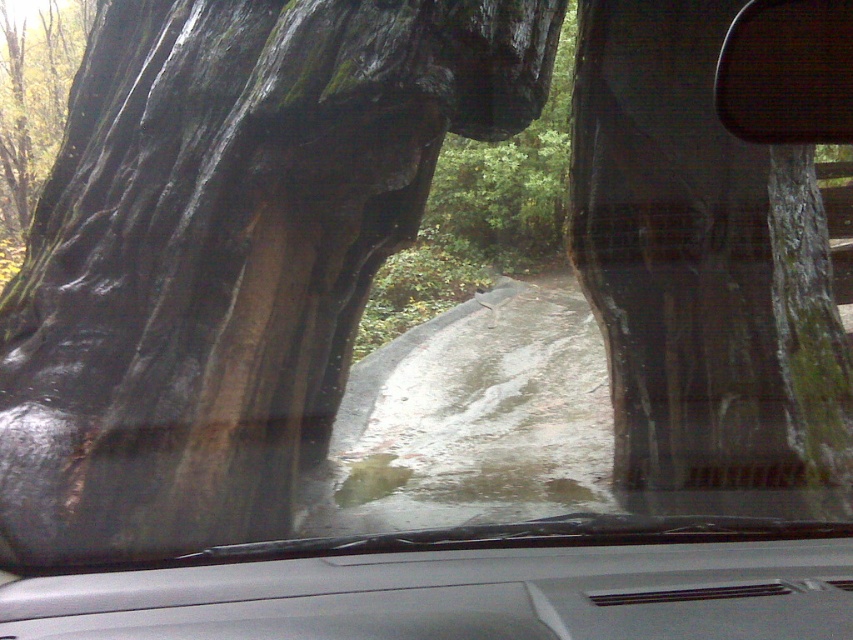
Is green mossy bark at right below green rough bark at upper left?

Correct, green mossy bark at right is located below green rough bark at upper left.

Can you confirm if green mossy bark at right is wider than green rough bark at upper left?

Correct, the width of green mossy bark at right exceeds that of green rough bark at upper left.

What do you see at coordinates (705, 276) in the screenshot? The width and height of the screenshot is (853, 640). I see `green mossy bark at right` at bounding box center [705, 276].

What are the coordinates of `green mossy bark at right` in the screenshot? It's located at (705, 276).